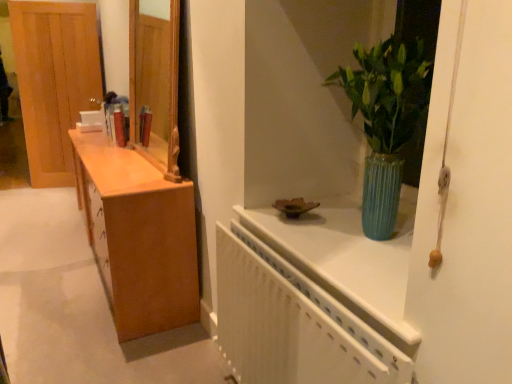
The height and width of the screenshot is (384, 512). I want to click on green ribbed vase at upper right, so click(386, 120).

Is light brown wood door at left not close to green ribbed vase at upper right?

light brown wood door at left is far away from green ribbed vase at upper right.

Does point (71, 24) come farther from viewer compared to point (387, 156)?

Yes, it is behind point (387, 156).

Which of these two, light brown wood door at left or green ribbed vase at upper right, is smaller?

With smaller size is green ribbed vase at upper right.

Would you say light brown wood door at left is inside or outside green ribbed vase at upper right?

The correct answer is: outside.

Who is taller, white textured radiator at upper right or green ribbed vase at upper right?

Standing taller between the two is white textured radiator at upper right.

Which is behind, point (231, 244) or point (369, 121)?

The point (231, 244) is farther.

Based on their sizes in the image, would you say white textured radiator at upper right is bigger or smaller than green ribbed vase at upper right?

white textured radiator at upper right is bigger than green ribbed vase at upper right.

Considering their positions, is white textured radiator at upper right located in front of or behind green ribbed vase at upper right?

Clearly, white textured radiator at upper right is in front of green ribbed vase at upper right.

Is the depth of light brown wood door at left greater than that of white textured radiator at upper right?

Yes, it is.

Is light brown wood door at left positioned beyond the bounds of white textured radiator at upper right?

Absolutely, light brown wood door at left is external to white textured radiator at upper right.

Which of these two, light brown wood door at left or white textured radiator at upper right, is thinner?

light brown wood door at left is thinner.

Who is more distant, green ribbed vase at upper right or white textured radiator at upper right?

green ribbed vase at upper right is further from the camera.

What's the angular difference between green ribbed vase at upper right and white textured radiator at upper right's facing directions?

The angular difference between green ribbed vase at upper right and white textured radiator at upper right is 0.317 degrees.

Is green ribbed vase at upper right taller than white textured radiator at upper right?

Incorrect, the height of green ribbed vase at upper right is not larger of that of white textured radiator at upper right.

Who is bigger, green ribbed vase at upper right or white textured radiator at upper right?

Bigger between the two is white textured radiator at upper right.

Is point (309, 334) farther from camera compared to point (19, 82)?

No, (309, 334) is closer to viewer.

Is white textured radiator at upper right in contact with light brown wood door at left?

No, white textured radiator at upper right is not making contact with light brown wood door at left.

Can you tell me how much white textured radiator at upper right and light brown wood door at left differ in facing direction?

The angle between the facing direction of white textured radiator at upper right and the facing direction of light brown wood door at left is 76.5 degrees.

From the image's perspective, which object appears higher, white textured radiator at upper right or light brown wood door at left?

light brown wood door at left is shown above in the image.

Is point (382, 157) closer to camera compared to point (92, 25)?

Yes.

Does green ribbed vase at upper right have a lesser width compared to light brown wood door at left?

No.

Where is `door located behind the green ribbed vase at upper right`? door located behind the green ribbed vase at upper right is located at coordinates (54, 81).

Is green ribbed vase at upper right turned away from light brown wood door at left?

No, light brown wood door at left is not at the back of green ribbed vase at upper right.

I want to click on door below the green ribbed vase at upper right (from a real-world perspective), so (x=54, y=81).

The image size is (512, 384). In order to click on houseplant behind the white textured radiator at upper right in this screenshot , I will do `click(386, 120)`.

Which object lies further to the anchor point light brown wood door at left, green ribbed vase at upper right or white textured radiator at upper right?

green ribbed vase at upper right lies further to light brown wood door at left than the other object.

When comparing their distances from white textured radiator at upper right, does light brown wood door at left or green ribbed vase at upper right seem closer?

green ribbed vase at upper right lies closer to white textured radiator at upper right than the other object.

Looking at the image, which one is located closer to light brown wood door at left, white textured radiator at upper right or green ribbed vase at upper right?

white textured radiator at upper right lies closer to light brown wood door at left than the other object.

Based on their spatial positions, is white textured radiator at upper right or light brown wood door at left closer to green ribbed vase at upper right?

white textured radiator at upper right is positioned closer to the anchor green ribbed vase at upper right.

From the image, which object appears to be farther from white textured radiator at upper right, green ribbed vase at upper right or light brown wood door at left?

light brown wood door at left is further to white textured radiator at upper right.

Estimate the real-world distances between objects in this image. Which object is closer to green ribbed vase at upper right, light brown wood door at left or white textured radiator at upper right?

white textured radiator at upper right lies closer to green ribbed vase at upper right than the other object.

Find the location of `houseplant positioned between white textured radiator at upper right and light brown wood door at left from near to far`. houseplant positioned between white textured radiator at upper right and light brown wood door at left from near to far is located at coordinates (386, 120).